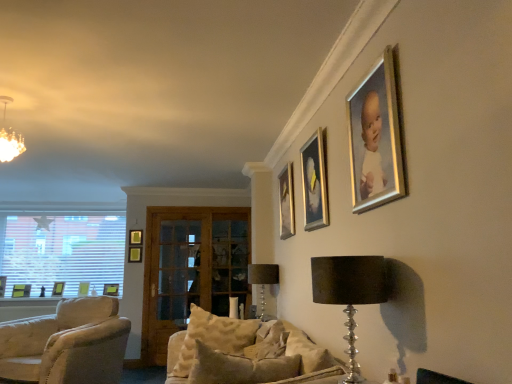
Question: In terms of size, does clear glass door at center, placed as the 2th glass door when sorted from right to left, appear bigger or smaller than matte black picture frame at lower left, positioned as the 4th picture frame in front-to-back order?

Choices:
 (A) big
 (B) small

Answer: (A)

Question: Would you say clear glass door at center, which is the first glass door from left to right, is to the left or to the right of matte black picture frame at lower left, positioned as the 4th picture frame in front-to-back order, in the picture?

Choices:
 (A) right
 (B) left

Answer: (A)

Question: Based on their relative distances, which object is nearer to the matte black picture frame at lower left, the seventh picture frame positioned from the right?

Choices:
 (A) beige fabric couch at center
 (B) matte green picture frame at lower left, the 2th picture frame from the back
 (C) textured beige pillow at center
 (D) matte gold chandelier at upper left
 (E) metallic gold picture frame at upper center, which is the 3th picture frame in front-to-back order

Answer: (B)

Question: Which is nearer to the matte gold chandelier at upper left?

Choices:
 (A) gold-framed picture at upper center, which appears as the second picture frame when viewed from the right
 (B) matte black picture frame at lower left, the seventh picture frame positioned from the right
 (C) clear glass door at center, which appears as the second glass door when viewed from the left
 (D) clear glass door at center, which is the first glass door from left to right
 (E) satin black table lamp at center, the second table lamp in the front-to-back sequence

Answer: (E)